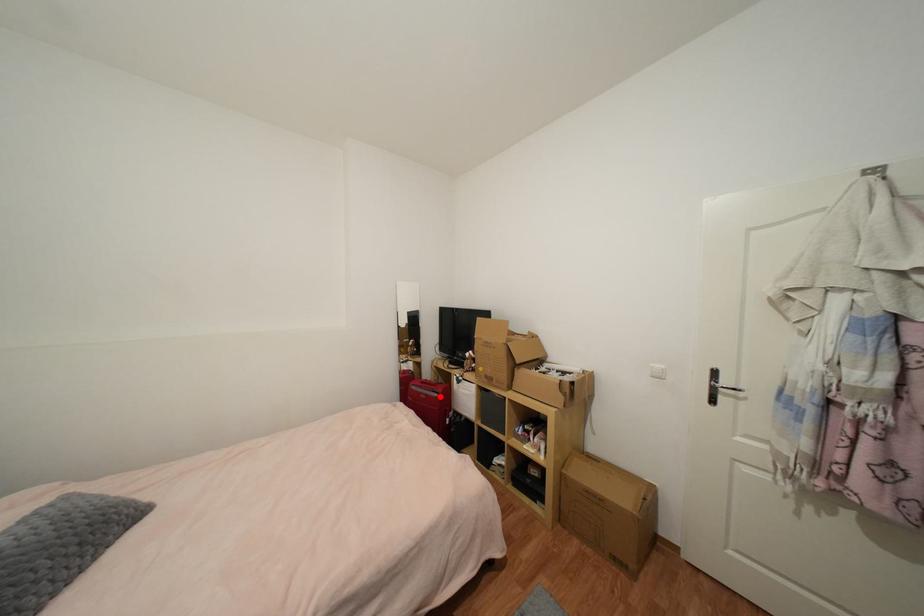
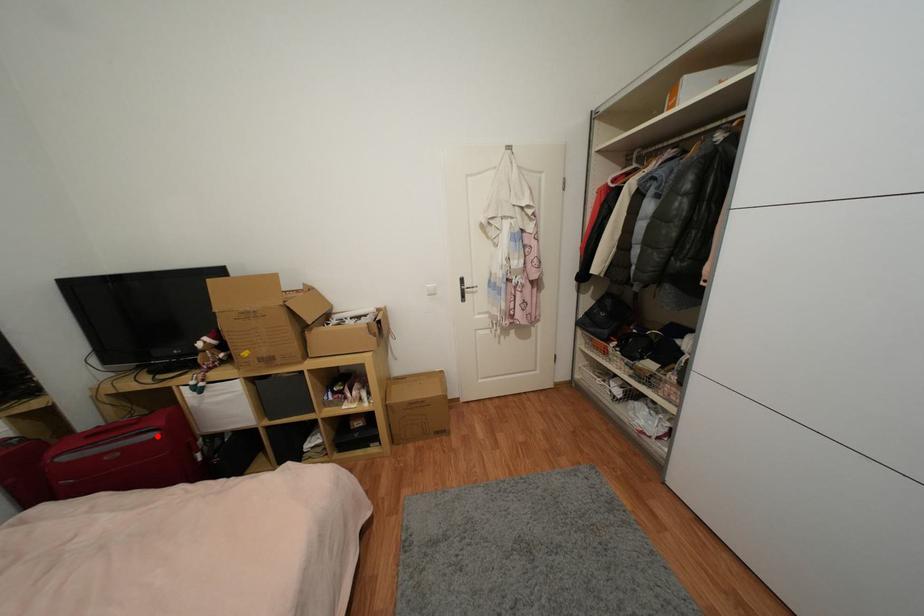
I am providing you with two images of the same scene from different viewpoints. A red point is marked on the first image and another point is marked on the second image. Do the highlighted points in image1 and image2 indicate the same real-world spot?

Yes